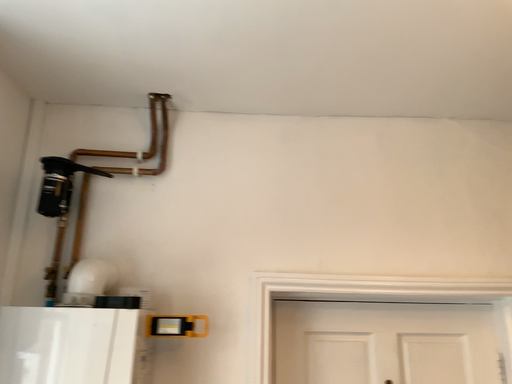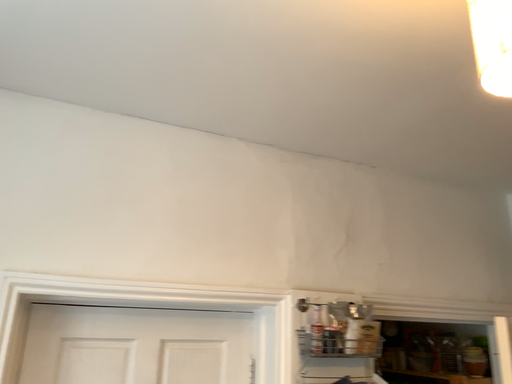
Question: Which way did the camera rotate in the video?

Choices:
 (A) rotated right
 (B) rotated left

Answer: (A)